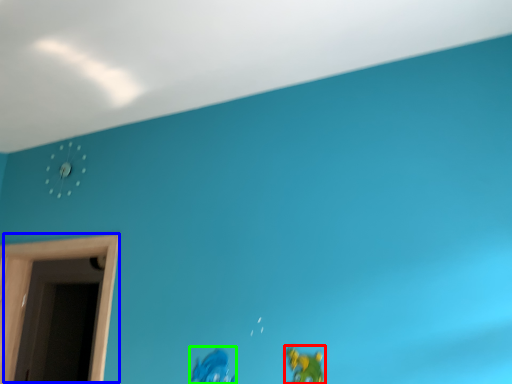
Question: Estimate the real-world distances between objects in this image. Which object is closer to toy (highlighted by a red box), window (highlighted by a blue box) or toy (highlighted by a green box)?

Choices:
 (A) window
 (B) toy

Answer: (B)